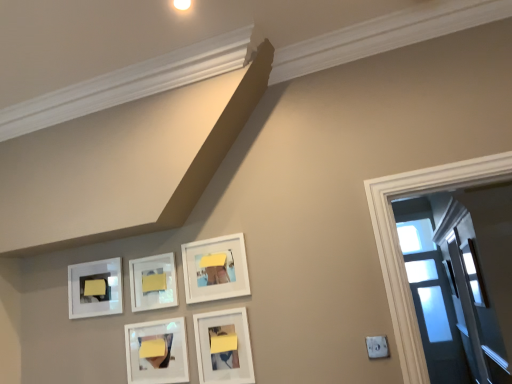
Question: Is white matte picture frame at upper left, the 1th picture frame positioned from the left, at the left side of matte yellow paper at upper left, which ranks as the 2th furniture in right-to-left order?

Choices:
 (A) yes
 (B) no

Answer: (A)

Question: Is white matte picture frame at upper left, the 5th picture frame when ordered from right to left, next to matte yellow paper at upper left, which is the first furniture from left to right?

Choices:
 (A) yes
 (B) no

Answer: (A)

Question: Is white matte picture frame at upper left, the 1th picture frame positioned from the left, thinner than matte yellow paper at upper left, which ranks as the 2th furniture in right-to-left order?

Choices:
 (A) yes
 (B) no

Answer: (A)

Question: Can you confirm if white matte picture frame at upper left, the 1th picture frame positioned from the left, is wider than matte yellow paper at upper left, positioned as the first furniture in back-to-front order?

Choices:
 (A) no
 (B) yes

Answer: (A)

Question: Can you confirm if white matte picture frame at upper left, the 1th picture frame positioned from the left, is smaller than matte yellow paper at upper left, which is the 2th furniture in front-to-back order?

Choices:
 (A) no
 (B) yes

Answer: (A)

Question: Is matte yellow paper at upper left, positioned as the first furniture in back-to-front order, to the left or to the right of clear glass window at right in the image?

Choices:
 (A) left
 (B) right

Answer: (A)

Question: Do you think matte yellow paper at upper left, which ranks as the 2th furniture in right-to-left order, is within clear glass window at right, or outside of it?

Choices:
 (A) inside
 (B) outside

Answer: (B)

Question: Is matte yellow paper at upper left, which ranks as the 2th furniture in right-to-left order, bigger or smaller than clear glass window at right?

Choices:
 (A) small
 (B) big

Answer: (A)

Question: From a real-world perspective, is matte yellow paper at upper left, which is the first furniture from left to right, above or below clear glass window at right?

Choices:
 (A) above
 (B) below

Answer: (A)

Question: Is point (183, 327) positioned closer to the camera than point (168, 286)?

Choices:
 (A) farther
 (B) closer

Answer: (B)

Question: From a real-world perspective, is matte white picture frame at lower center, the 3th picture frame when ordered from left to right, above or below white matte picture frame at center, positioned as the 2th picture frame in left-to-right order?

Choices:
 (A) below
 (B) above

Answer: (A)

Question: Considering the positions of matte white picture frame at lower center, which appears as the 3th picture frame when viewed from the right, and white matte picture frame at center, the fourth picture frame when ordered from right to left, in the image, is matte white picture frame at lower center, which appears as the 3th picture frame when viewed from the right, taller or shorter than white matte picture frame at center, the fourth picture frame when ordered from right to left,?

Choices:
 (A) tall
 (B) short

Answer: (A)

Question: Is matte white picture frame at lower center, which appears as the 3th picture frame when viewed from the right, bigger or smaller than white matte picture frame at center, the fourth picture frame when ordered from right to left?

Choices:
 (A) small
 (B) big

Answer: (B)

Question: From a real-world perspective, is white matte picture frame at upper center, the 2th picture frame when ordered from right to left, physically located above or below matte yellow paper at upper left, which is the first furniture from left to right?

Choices:
 (A) below
 (B) above

Answer: (A)

Question: Looking at their shapes, would you say white matte picture frame at upper center, the 4th picture frame positioned from the left, is wider or thinner than matte yellow paper at upper left, which is the first furniture from left to right?

Choices:
 (A) wide
 (B) thin

Answer: (A)